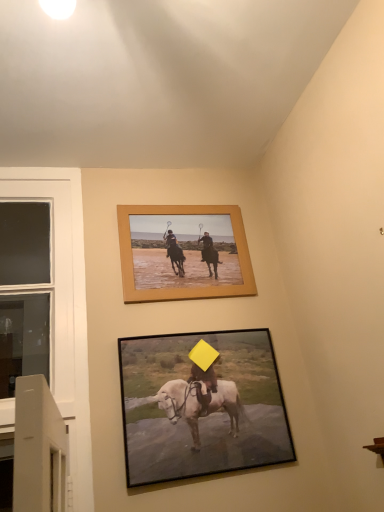
Question: Is black matte picture frame at lower center, the second picture frame positioned from the top, further to the viewer compared to wooden frame at upper center, arranged as the second picture frame when ordered from the bottom?

Choices:
 (A) yes
 (B) no

Answer: (B)

Question: From a real-world perspective, is black matte picture frame at lower center, which is the first picture frame in bottom-to-top order, positioned under wooden frame at upper center, arranged as the second picture frame when ordered from the bottom, based on gravity?

Choices:
 (A) no
 (B) yes

Answer: (B)

Question: From the image's perspective, is black matte picture frame at lower center, which is the first picture frame in bottom-to-top order, on top of wooden frame at upper center, the first picture frame positioned from the top?

Choices:
 (A) no
 (B) yes

Answer: (A)

Question: Is black matte picture frame at lower center, the second picture frame positioned from the top, to the left of wooden frame at upper center, arranged as the second picture frame when ordered from the bottom, from the viewer's perspective?

Choices:
 (A) no
 (B) yes

Answer: (A)

Question: Is black matte picture frame at lower center, which is the first picture frame in bottom-to-top order, next to wooden frame at upper center, the first picture frame positioned from the top?

Choices:
 (A) no
 (B) yes

Answer: (A)

Question: Does black matte picture frame at lower center, which is the first picture frame in bottom-to-top order, have a greater width compared to wooden frame at upper center, the first picture frame positioned from the top?

Choices:
 (A) no
 (B) yes

Answer: (B)

Question: Can you confirm if black matte picture frame at lower center, the second picture frame positioned from the top, is thinner than white glass window at left?

Choices:
 (A) yes
 (B) no

Answer: (A)

Question: Is black matte picture frame at lower center, the second picture frame positioned from the top, positioned behind white glass window at left?

Choices:
 (A) no
 (B) yes

Answer: (A)

Question: Can you confirm if black matte picture frame at lower center, the second picture frame positioned from the top, is taller than white glass window at left?

Choices:
 (A) no
 (B) yes

Answer: (A)

Question: Is black matte picture frame at lower center, which is the first picture frame in bottom-to-top order, oriented towards white glass window at left?

Choices:
 (A) no
 (B) yes

Answer: (A)

Question: From the image's perspective, is black matte picture frame at lower center, the second picture frame positioned from the top, above white glass window at left?

Choices:
 (A) yes
 (B) no

Answer: (B)

Question: Is black matte picture frame at lower center, which is the first picture frame in bottom-to-top order, positioned in front of white glass window at left?

Choices:
 (A) yes
 (B) no

Answer: (A)

Question: Can you confirm if white glass window at left is smaller than black matte picture frame at lower center, the second picture frame positioned from the top?

Choices:
 (A) yes
 (B) no

Answer: (B)